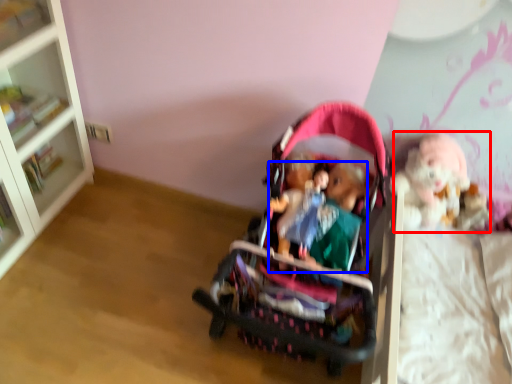
Question: Which object appears farthest to the camera in this image, doll (highlighted by a red box) or person (highlighted by a blue box)?

Choices:
 (A) doll
 (B) person

Answer: (A)